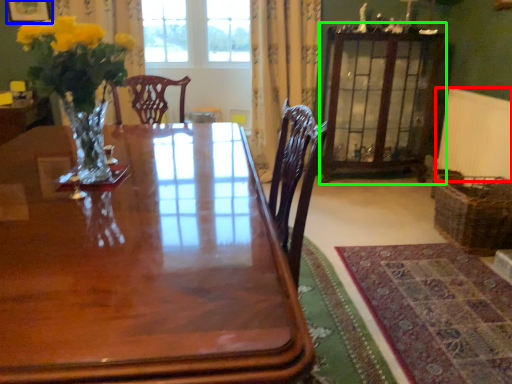
Question: Considering the real-world distances, which object is closest to radiator (highlighted by a red box)? picture frame (highlighted by a blue box) or armoire (highlighted by a green box).

Choices:
 (A) picture frame
 (B) armoire

Answer: (B)